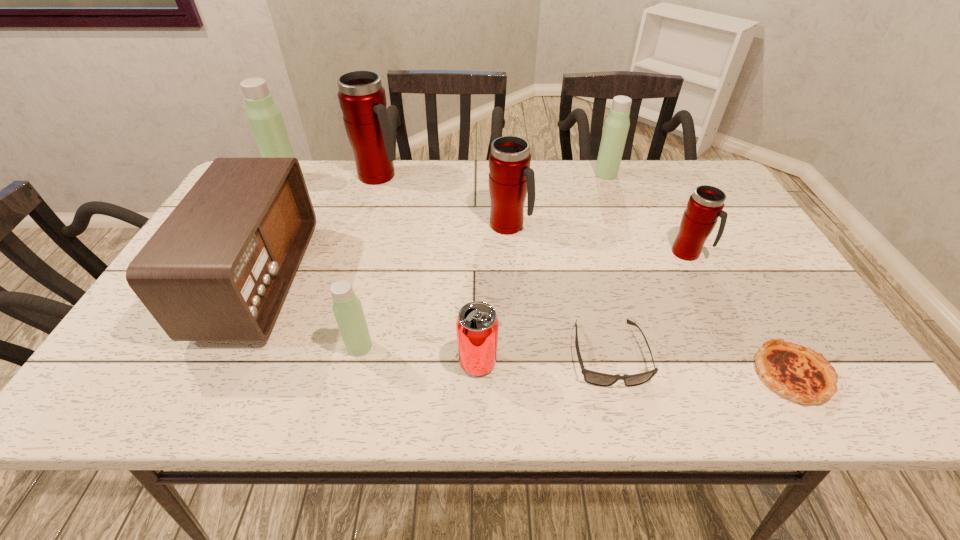
You are a GUI agent. You are given a task and a screenshot of the screen. Output one action in this format:
    pyautogui.click(x=<x>, y=<y>)
    Task: Click on the second light thermos bottle from right to left
    
    Given the screenshot: What is the action you would take?
    pyautogui.click(x=347, y=308)

I want to click on the rightmost red thermos bottle, so click(704, 207).

What are the coordinates of `the rightmost thermos bottle` in the screenshot? It's located at (704, 207).

The image size is (960, 540). In order to click on the third shortest object in this screenshot , I will do `click(477, 324)`.

Locate an element on the screen. The image size is (960, 540). soda can is located at coordinates (477, 324).

This screenshot has height=540, width=960. Identify the location of sunglasses. (595, 378).

The height and width of the screenshot is (540, 960). What are the coordinates of `the fourth object from right to left` in the screenshot? It's located at (595, 378).

At what (x,y) coordinates should I click in order to perform the action: click on quiche. Please return your answer as a coordinate pair (x, y). The height and width of the screenshot is (540, 960). Looking at the image, I should click on (794, 371).

Find the location of `free space located on the front of the leftmost light thermos bottle`. free space located on the front of the leftmost light thermos bottle is located at coordinates (270, 209).

Locate an element on the screen. The image size is (960, 540). vacant point located 0.250m on the side with the handle of the farthest red thermos bottle is located at coordinates (482, 176).